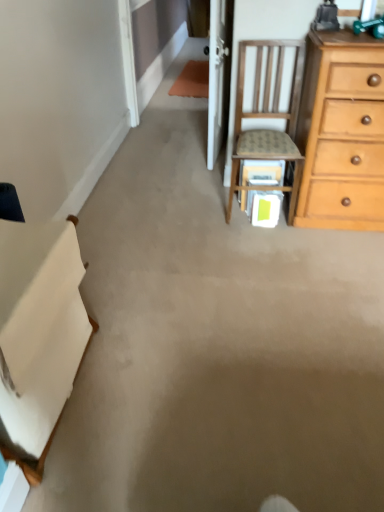
Question: From their relative heights in the image, would you say white fabric at left is taller or shorter than wooden chair at upper right?

Choices:
 (A) short
 (B) tall

Answer: (A)

Question: Does point (23, 471) appear closer or farther from the camera than point (294, 177)?

Choices:
 (A) farther
 (B) closer

Answer: (B)

Question: Is white fabric at left bigger or smaller than wooden chair at upper right?

Choices:
 (A) big
 (B) small

Answer: (A)

Question: In terms of size, does wooden chair at upper right appear bigger or smaller than white fabric at left?

Choices:
 (A) big
 (B) small

Answer: (B)

Question: Relative to white fabric at left, is wooden chair at upper right in front or behind?

Choices:
 (A) front
 (B) behind

Answer: (B)

Question: From their relative heights in the image, would you say wooden chair at upper right is taller or shorter than white fabric at left?

Choices:
 (A) short
 (B) tall

Answer: (B)

Question: From a real-world perspective, is wooden chair at upper right above or below white fabric at left?

Choices:
 (A) below
 (B) above

Answer: (B)